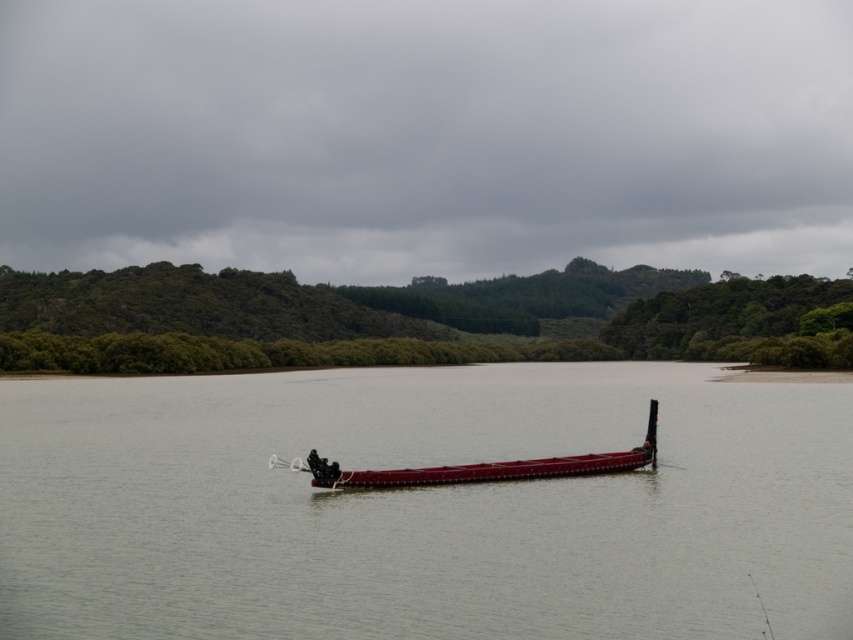
Question: Which of the following is the farthest from the observer?

Choices:
 (A) (389, 477)
 (B) (62, 493)

Answer: (A)

Question: Observing the image, what is the correct spatial positioning of smooth water at center in reference to shiny red canoe at center?

Choices:
 (A) below
 (B) above

Answer: (A)

Question: Does smooth water at center come behind shiny red canoe at center?

Choices:
 (A) yes
 (B) no

Answer: (B)

Question: Does smooth water at center have a smaller size compared to shiny red canoe at center?

Choices:
 (A) yes
 (B) no

Answer: (B)

Question: Which object is closer to the camera taking this photo?

Choices:
 (A) smooth water at center
 (B) shiny red canoe at center

Answer: (A)